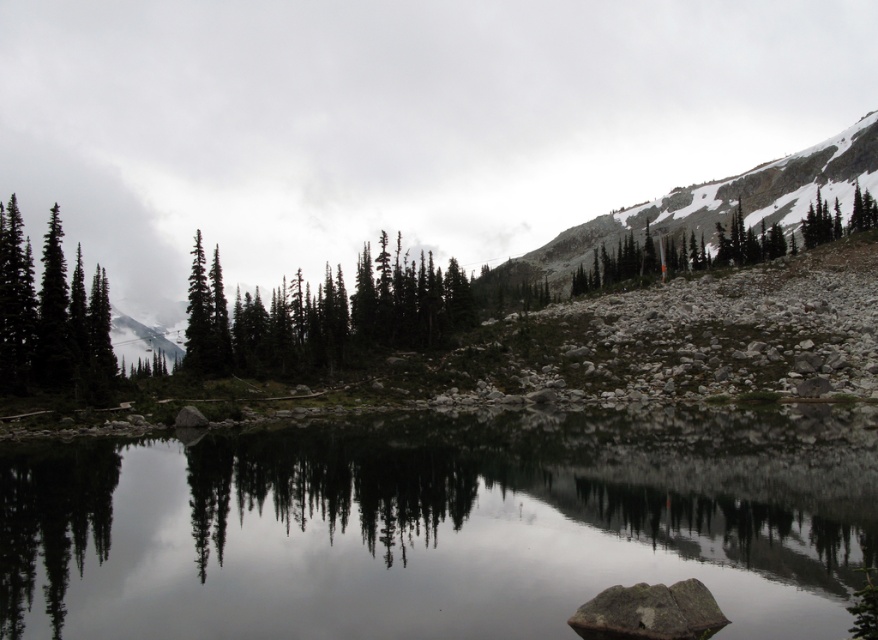
You are an outdoor photographer planning to capture the rocky gray mountain at upper right and the green matte evergreen trees at left in a single shot. Based on their sizes, which object should you focus on first to ensure both are in frame?

The rocky gray mountain at upper right is larger than the green matte evergreen trees at left, so you should focus on the rocky gray mountain at upper right first to ensure both fit in the frame.

You are an environmental scientist assessing the landscape. Based on the image, which object takes up more area in the scene between the smooth reflective water at center and the green matte trees at center?

The green matte trees at center occupy more area than the smooth reflective water at center in the scene.

You are a hiker planning to take a photo of the green matte trees at center and the rocky gray mountain at upper right. From your current position, which object is located to the left of the other?

The green matte trees at center is positioned on the left side of rocky gray mountain at upper right, so the trees are to the left of the mountain.